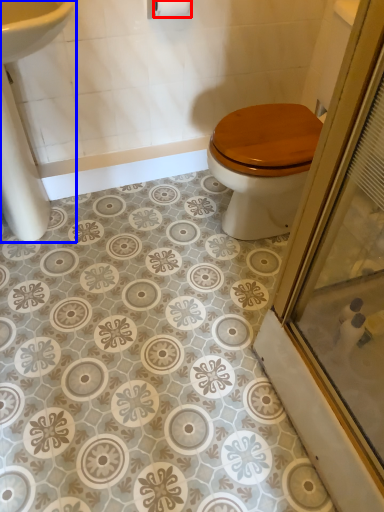
Question: Which point is further to the camera, toilet paper (highlighted by a red box) or sink (highlighted by a blue box)?

Choices:
 (A) toilet paper
 (B) sink

Answer: (A)